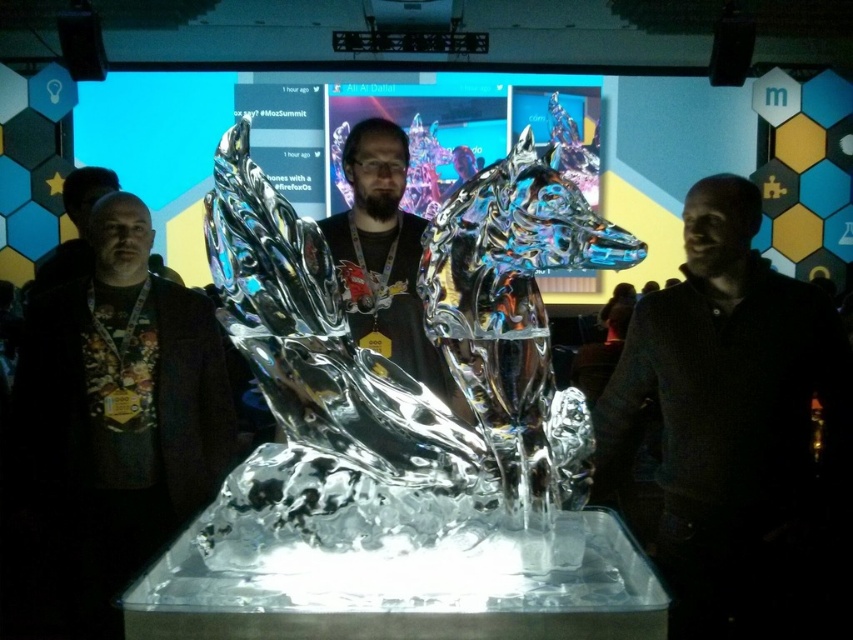
You are attending a tech conference and notice a dark gray sweater at right near the ice sculpture. If you want to place a small note on the sweater, where should you place it relative to the ice sculpture?

The dark gray sweater at right is located at point 0.672 on the horizontal axis and 0.866 on the vertical axis, so you should place the note to the right and slightly above the ice sculpture.